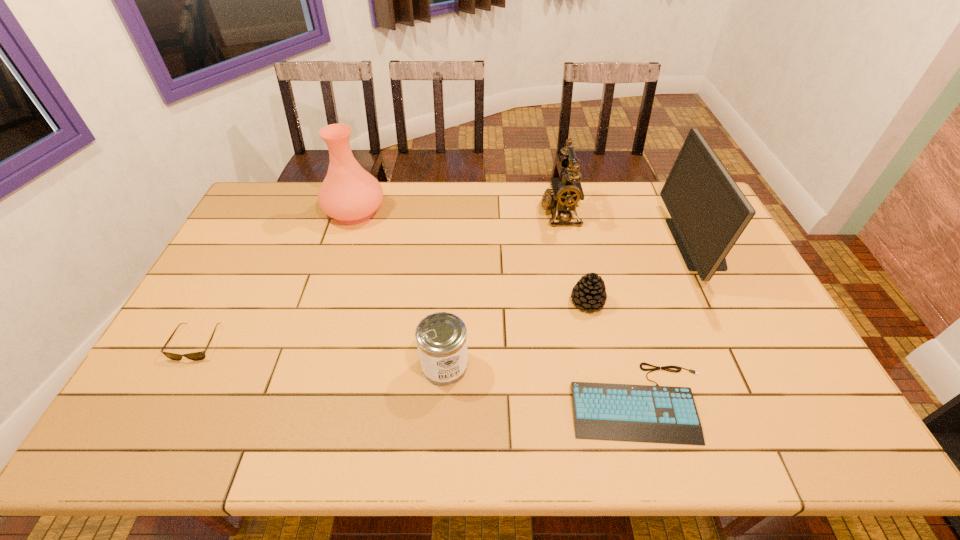
Identify the location of free space that is in between the computer monitor and the telephone. (629, 228).

This screenshot has height=540, width=960. Identify the location of free space between the computer monitor and the can. (571, 305).

At what (x,y) coordinates should I click in order to perform the action: click on vacant area that lies between the second object from left to right and the third tallest object. Please return your answer as a coordinate pair (x, y). This screenshot has width=960, height=540. Looking at the image, I should click on (457, 212).

Where is `free space between the fourth shortest object and the telephone`? This screenshot has width=960, height=540. free space between the fourth shortest object and the telephone is located at coordinates (502, 289).

Identify the location of free space between the pinecone and the computer monitor. This screenshot has width=960, height=540. (642, 273).

Identify the location of free point between the sunglasses and the vase. The height and width of the screenshot is (540, 960). (276, 277).

The height and width of the screenshot is (540, 960). In order to click on blank region between the rightmost object and the leftmost object in this screenshot , I will do `click(447, 293)`.

The width and height of the screenshot is (960, 540). Find the location of `empty location between the fourth shortest object and the shortest object`. empty location between the fourth shortest object and the shortest object is located at coordinates (542, 383).

The width and height of the screenshot is (960, 540). In order to click on free space between the second shortest object and the vase in this screenshot , I will do `click(276, 277)`.

Where is `the closest object to the computer monitor`? the closest object to the computer monitor is located at coordinates (642, 413).